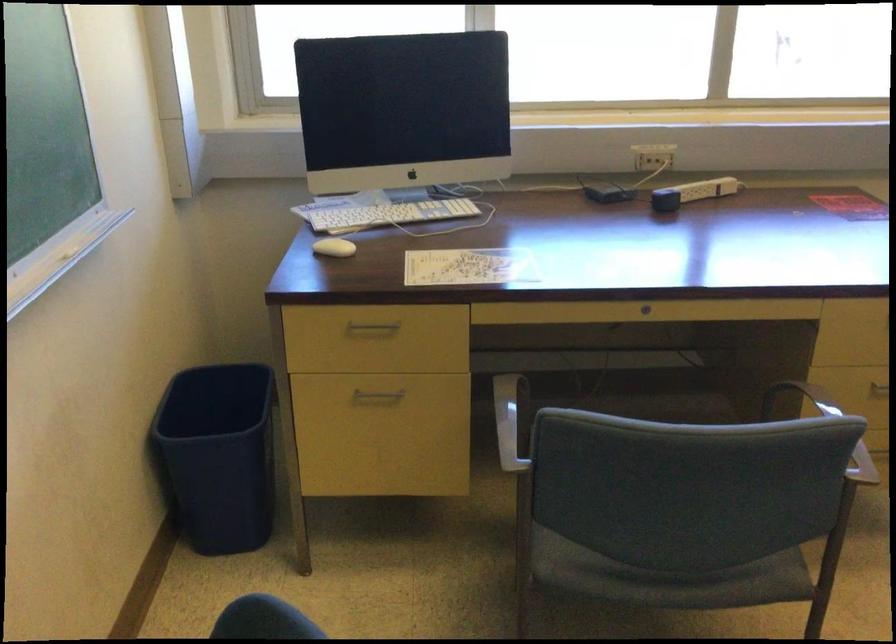
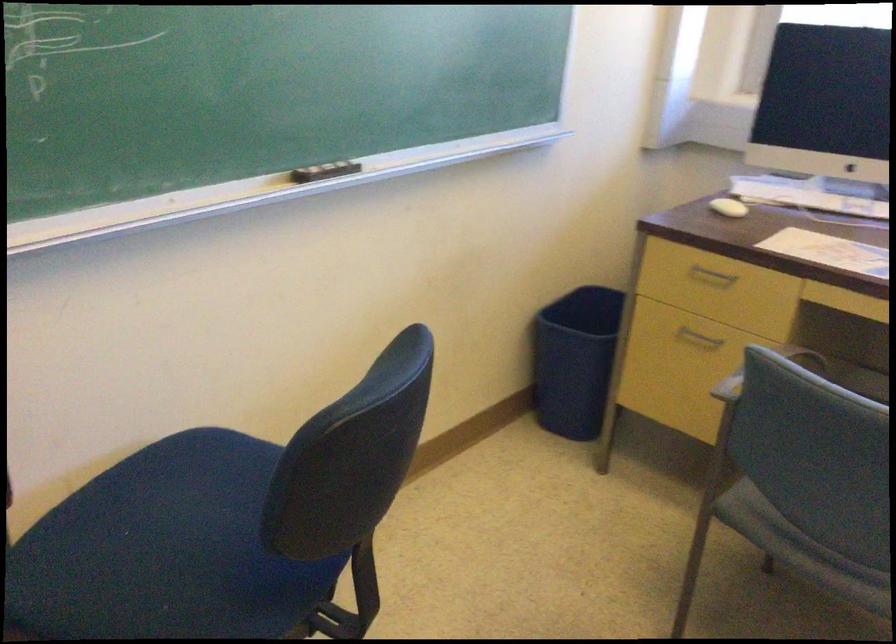
Where in the second image is the point corresponding to point (332, 252) from the first image?

(728, 207)